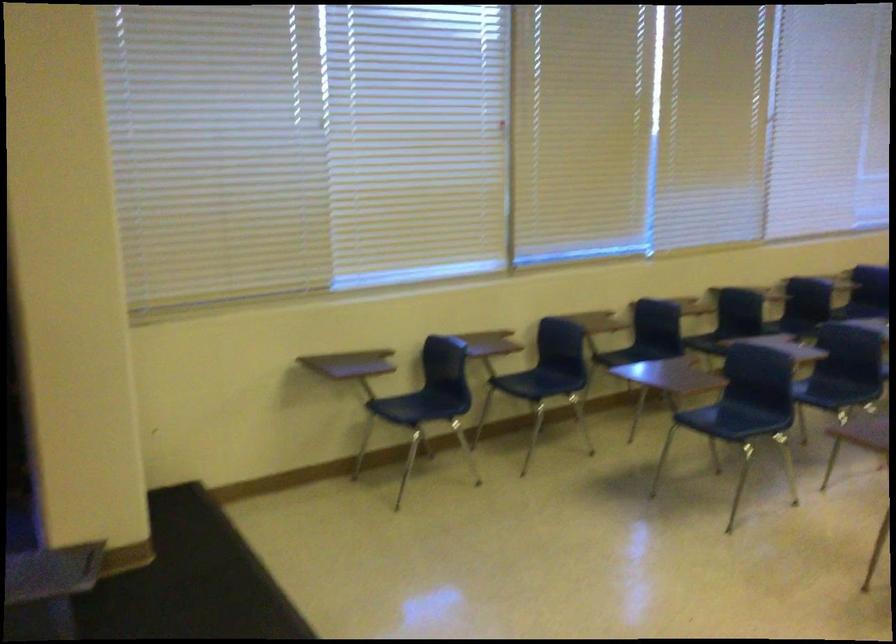
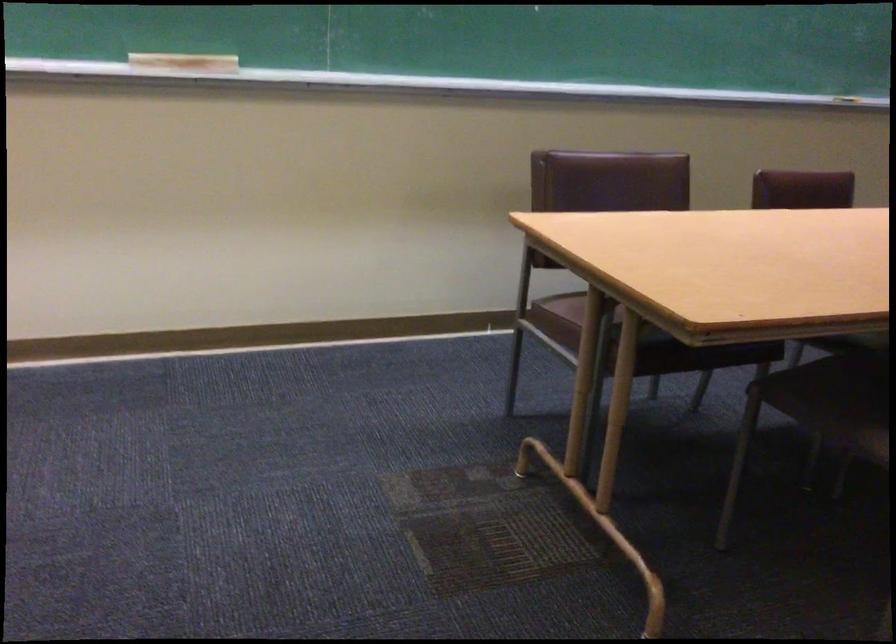
First-person continuous shooting, in which direction is the camera rotating?

The camera rotated toward left-down.